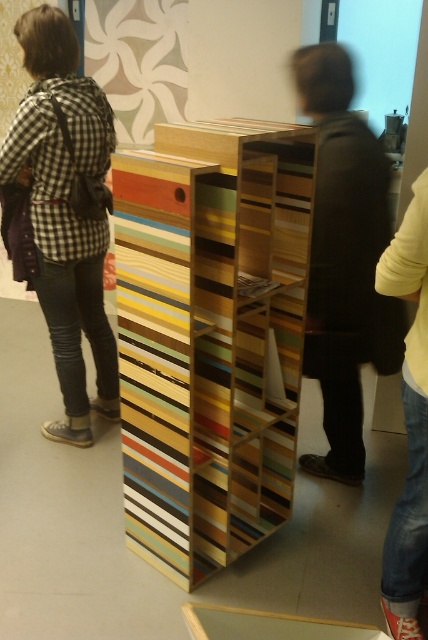
Where is the wooden striped bookshelf at center located in the image?

The wooden striped bookshelf at center is located at point (211, 337) in the image.

You are an artist in the gallery who wants to place a new sculpture between the dark brown leather jacket at center and the yellow fabric pants at lower right. Based on their positions, where should the sculpture be placed?

The sculpture should be placed below the dark brown leather jacket at center since it is positioned over the yellow fabric pants at lower right.